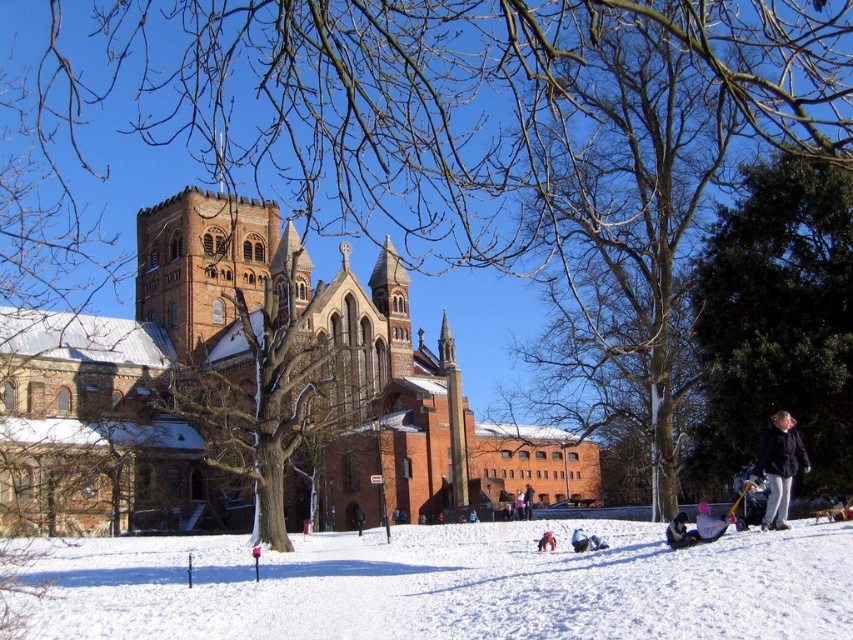
You are a photographer planning to take a winter landscape photo. You want to include both the white fluffy snow at lower center and the dark blue jacket at lower right in the frame. Based on their positions, which object should appear larger in your photo?

The white fluffy snow at lower center should appear larger in the photo because it is much taller than the dark blue jacket at lower right.

Looking at this image, you are standing at the center of the snowy area in the winter scene. You see a point marked at coordinates point (779, 467). Which object is this point located on?

The point (779, 467) is located on the dark blue jacket at lower right.